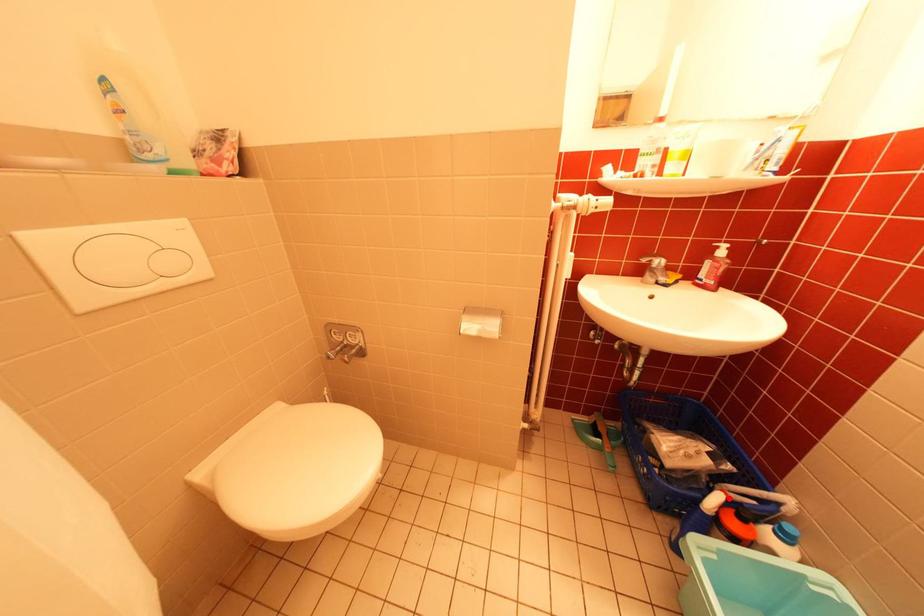
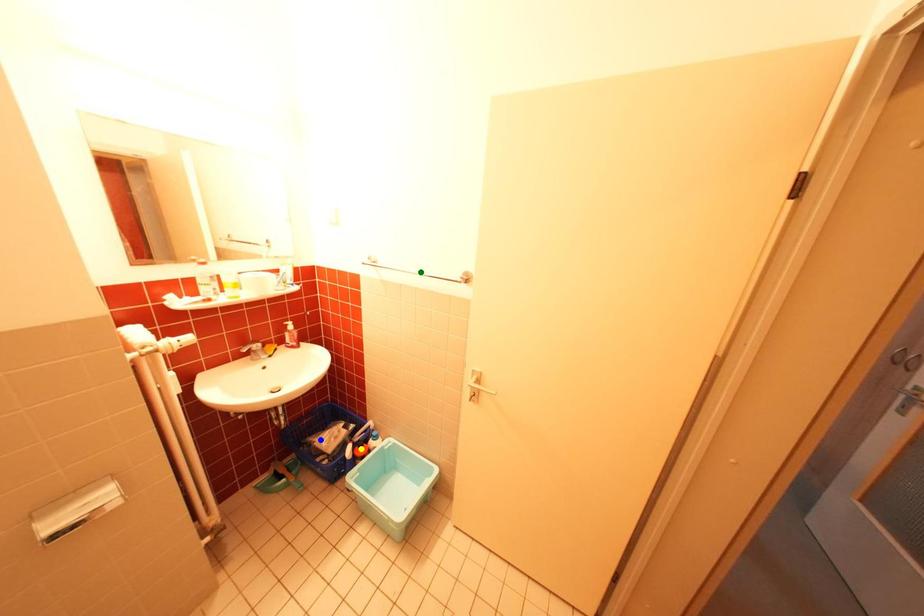
Question: I am providing you with two images of the same scene from different viewpoints. A red point is marked on the first image. You are given multiple points on the second image. Which mark in image 2 goes with the point in image 1?

Choices:
 (A) green point
 (B) yellow point
 (C) blue point

Answer: (B)